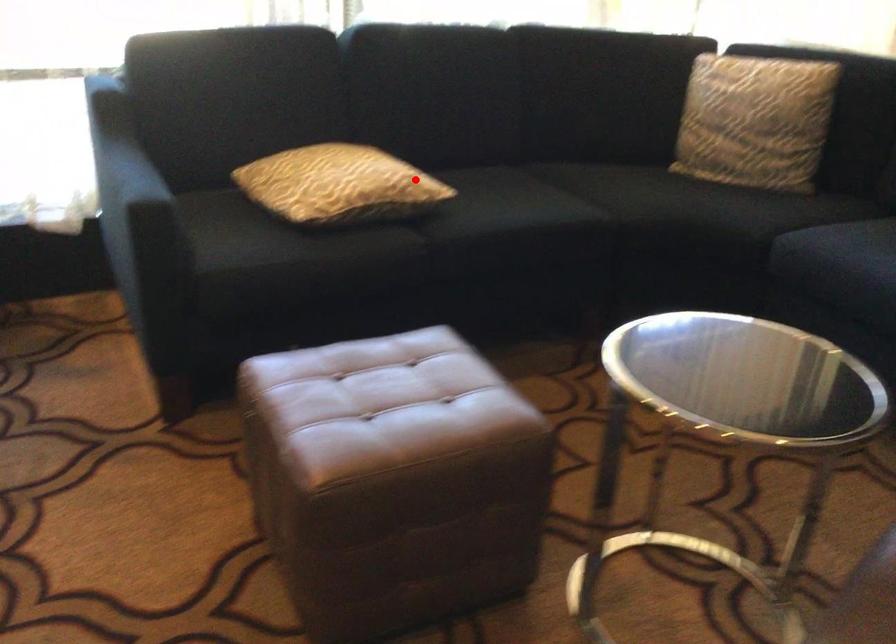
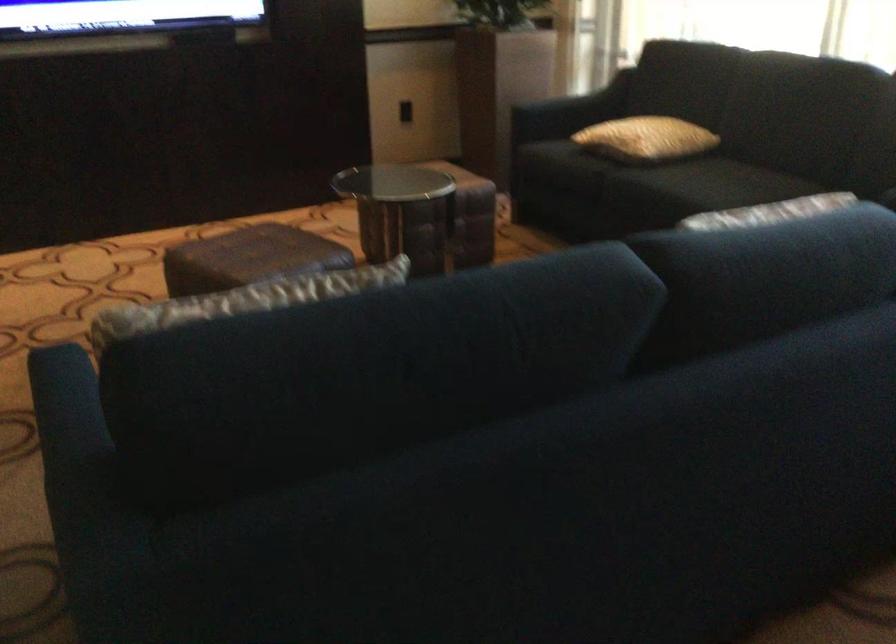
Question: A red point is marked in image1. In image2, is the corresponding 3D point closer to the camera or farther? Reply with the corresponding letter.

Choices:
 (A) The corresponding 3D point is closer.
 (B) The corresponding 3D point is farther.

Answer: (B)